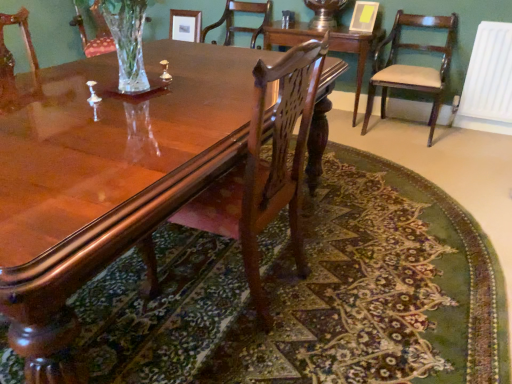
Question: From their relative heights in the image, would you say polished wood chair at center, placed as the first chair when sorted from front to back, is taller or shorter than glossy wood coffee table at center?

Choices:
 (A) short
 (B) tall

Answer: (B)

Question: Considering the positions of polished wood chair at center, which ranks as the second chair in left-to-right order, and glossy wood coffee table at center in the image, is polished wood chair at center, which ranks as the second chair in left-to-right order, wider or thinner than glossy wood coffee table at center?

Choices:
 (A) wide
 (B) thin

Answer: (B)

Question: Which object is positioned farthest from the wooden chair at center, which is the 3th chair in front-to-back order?

Choices:
 (A) polished wood chair at center, which appears as the 3th chair when viewed from the back
 (B) mahogany wood table at center
 (C) mahogany wood chair at right, positioned as the second chair in front-to-back order
 (D) glossy wood coffee table at center
 (E) white plastic radiator at right

Answer: (A)

Question: Based on their relative distances, which object is farther from the glossy wood coffee table at center?

Choices:
 (A) mahogany wood chair at right, positioned as the 3th chair in left-to-right order
 (B) polished wood chair at center, placed as the first chair when sorted from front to back
 (C) mahogany wood table at center
 (D) wooden chair at center, the third chair positioned from the right
 (E) white plastic radiator at right

Answer: (D)